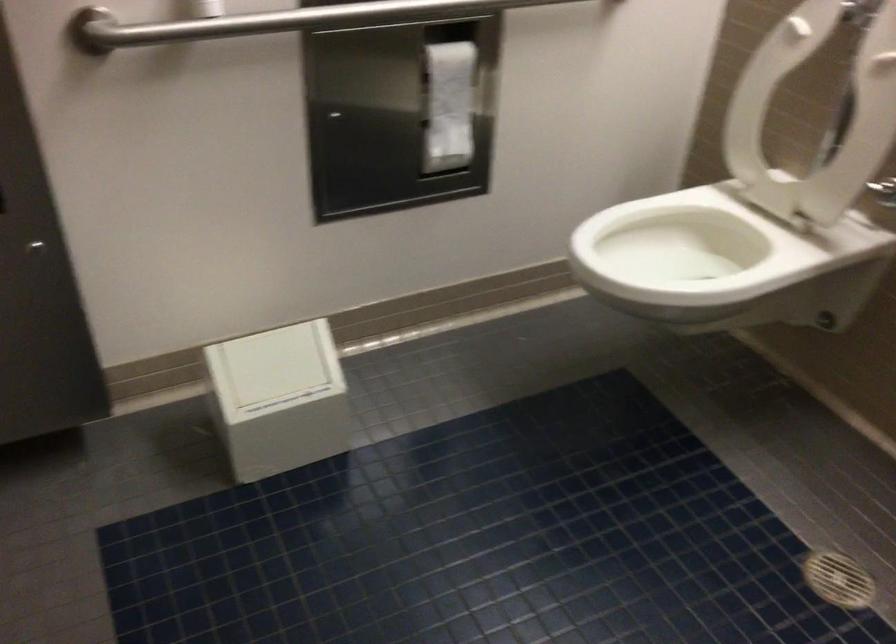
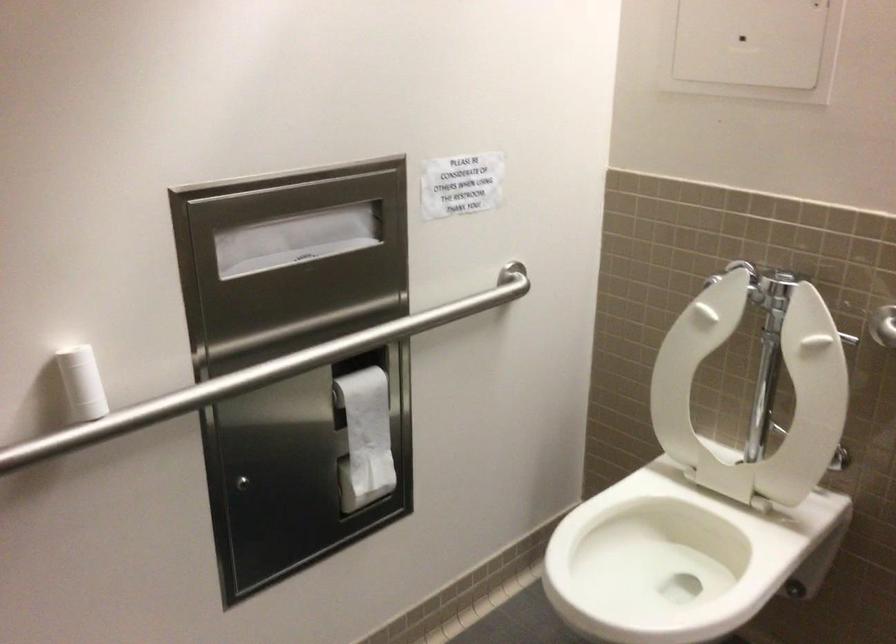
What movement of the cameraman would produce the second image?

The cameraman moved toward left, forward.